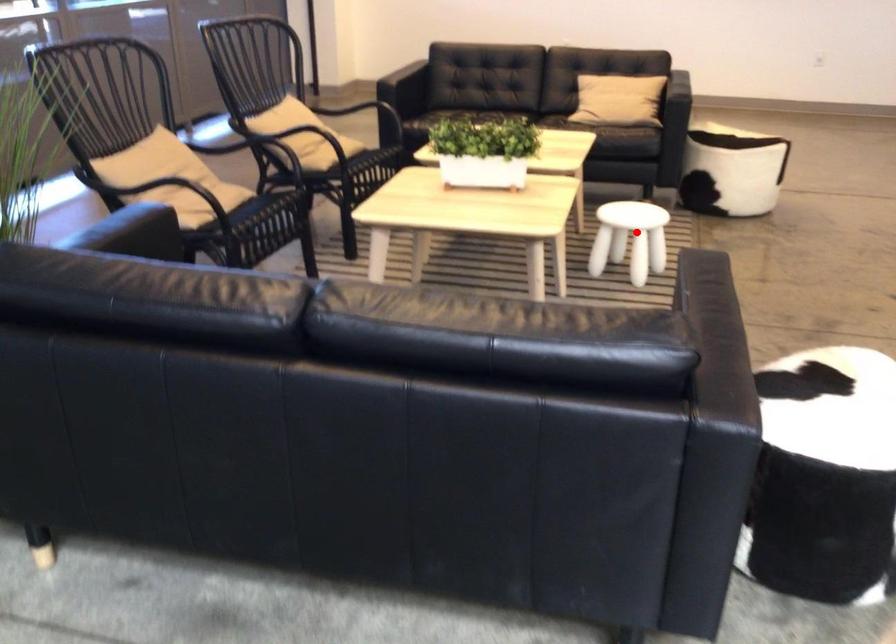
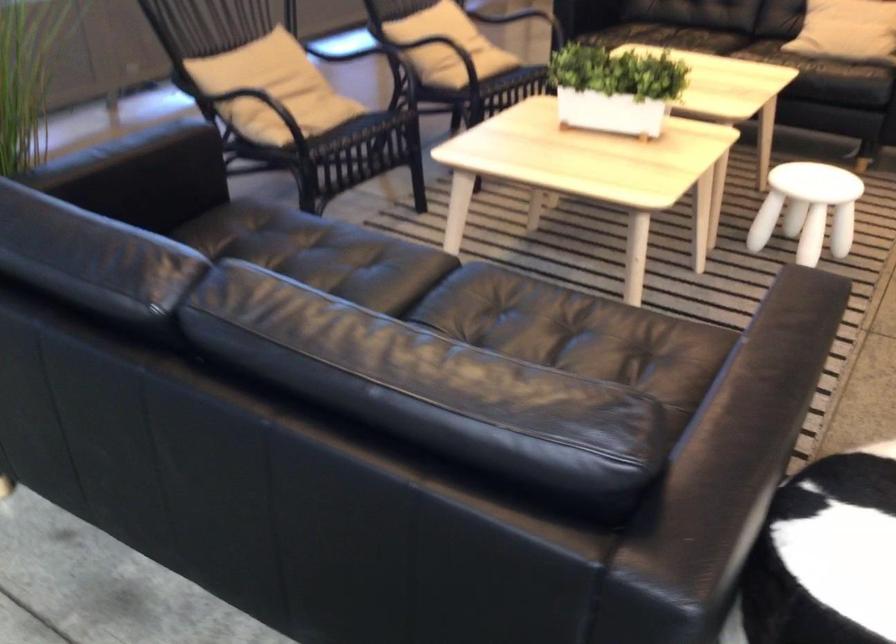
Where in the second image is the point corresponding to the highlighted location from the first image?

(807, 209)